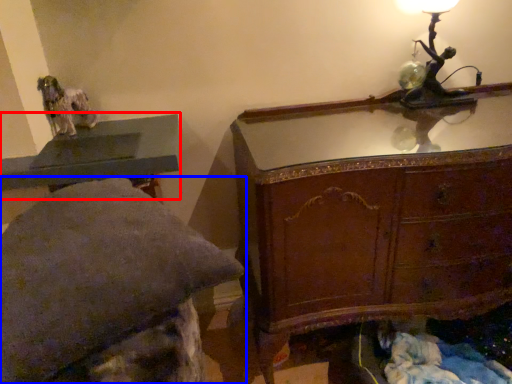
Question: Which of the following is the farthest to the observer, table (highlighted by a red box) or furniture (highlighted by a blue box)?

Choices:
 (A) table
 (B) furniture

Answer: (A)